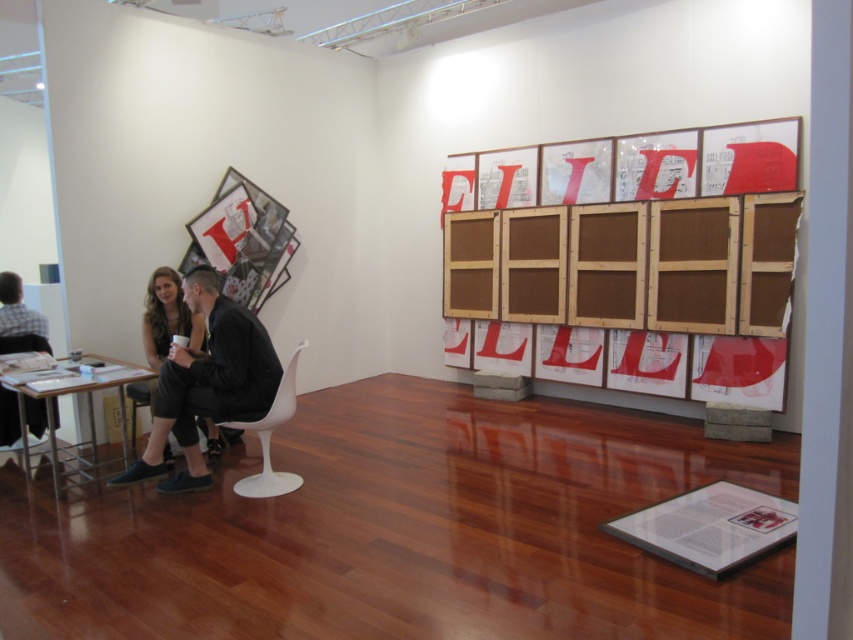
Question: Does black leather jacket at left appear over white plastic chair at center?

Choices:
 (A) yes
 (B) no

Answer: (A)

Question: Does white plastic chair at center have a lesser width compared to white plastic chair at left?

Choices:
 (A) no
 (B) yes

Answer: (A)

Question: Among these objects, which one is farthest from the camera?

Choices:
 (A) wooden framed artwork at upper right
 (B) black leather jacket at left
 (C) metallic silver table at lower left

Answer: (A)

Question: Which point appears farthest from the camera in this image?

Choices:
 (A) (148, 317)
 (B) (204, 308)

Answer: (A)

Question: Can you confirm if wooden framed artwork at upper right is positioned below matte black dress at lower left?

Choices:
 (A) no
 (B) yes

Answer: (A)

Question: Which point is farther to the camera?

Choices:
 (A) black leather jacket at left
 (B) wooden framed artwork at upper right
 (C) metallic silver table at lower left

Answer: (B)